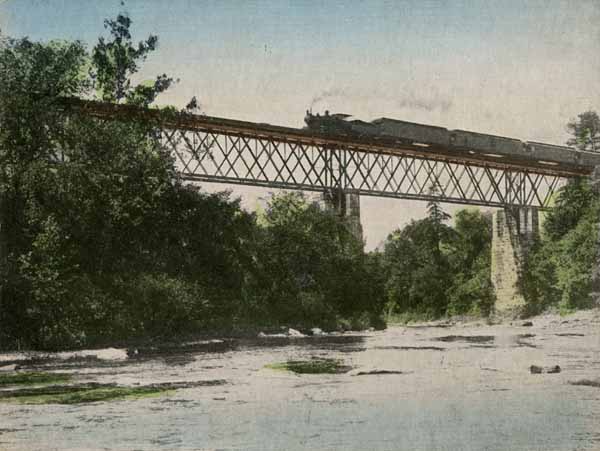
Identify the location of tressel. This screenshot has width=600, height=451. pos(287,138).